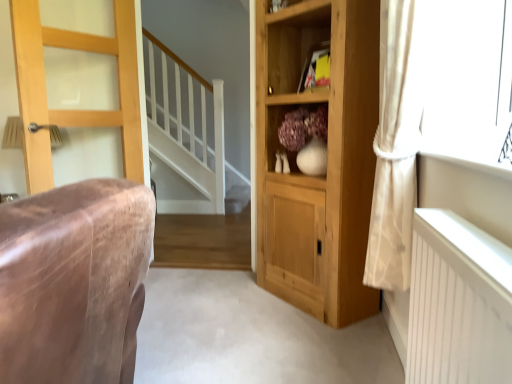
At what (x,y) coordinates should I click in order to perform the action: click on yellow paper at upper center. Please return your answer as a coordinate pair (x, y). The height and width of the screenshot is (384, 512). Looking at the image, I should click on (310, 61).

Image resolution: width=512 pixels, height=384 pixels. What do you see at coordinates (310, 61) in the screenshot?
I see `yellow paper at upper center` at bounding box center [310, 61].

The width and height of the screenshot is (512, 384). Describe the element at coordinates (395, 147) in the screenshot. I see `white sheer curtain at right` at that location.

Where is `natural wood cupboard at center`? The width and height of the screenshot is (512, 384). natural wood cupboard at center is located at coordinates (328, 158).

You are a GUI agent. You are given a task and a screenshot of the screen. Output one action in this format:
    pyautogui.click(x=<x>, y=<y>)
    Task: Click on the light brown wooden door at left
    The height and width of the screenshot is (384, 512).
    Given the screenshot: What is the action you would take?
    pyautogui.click(x=75, y=110)

Identify the location of wooden cabinet at center. The height and width of the screenshot is (384, 512). (295, 129).

Find the location of a particular element. Image resolution: width=512 pixels, height=384 pixels. yellow paper at upper center is located at coordinates (310, 61).

Can you confirm if natural wood cupboard at center is wider than white sheer curtain at right?

Yes, natural wood cupboard at center is wider than white sheer curtain at right.

How different are the orientations of natural wood cupboard at center and white sheer curtain at right in degrees?

natural wood cupboard at center and white sheer curtain at right are facing 41.5 degrees away from each other.

Would you say natural wood cupboard at center is inside or outside white sheer curtain at right?

natural wood cupboard at center lies outside white sheer curtain at right.

Between yellow paper at upper center and wooden cabinet at center, which one has more height?

With more height is wooden cabinet at center.

Who is more distant, yellow paper at upper center or wooden cabinet at center?

yellow paper at upper center.

Based on the photo, in the image, is yellow paper at upper center on the left side or the right side of wooden cabinet at center?

From the image, it's evident that yellow paper at upper center is to the right of wooden cabinet at center.

From the image's perspective, which is below, yellow paper at upper center or wooden cabinet at center?

wooden cabinet at center appears lower in the image.

Considering the relative positions of white sheer curtain at right and yellow paper at upper center in the image provided, is white sheer curtain at right to the left or to the right of yellow paper at upper center?

In the image, white sheer curtain at right appears on the right side of yellow paper at upper center.

Considering the relative positions of white sheer curtain at right and yellow paper at upper center in the image provided, is white sheer curtain at right in front of yellow paper at upper center?

Yes, it is in front of yellow paper at upper center.

From the image's perspective, is white sheer curtain at right beneath yellow paper at upper center?

Indeed, from the image's perspective, white sheer curtain at right is shown beneath yellow paper at upper center.

From a real-world perspective, relative to yellow paper at upper center, is wooden cabinet at center vertically above or below?

In terms of real-world spatial position, wooden cabinet at center is below yellow paper at upper center.

This screenshot has height=384, width=512. In the image, there is a wooden cabinet at center. Find the location of `book above it (from the image's perspective)`. book above it (from the image's perspective) is located at coordinates (310, 61).

Is yellow paper at upper center surrounded by wooden cabinet at center?

That's incorrect, yellow paper at upper center is not inside wooden cabinet at center.

Which object is more forward, wooden cabinet at center or yellow paper at upper center?

wooden cabinet at center is in front.

Is yellow paper at upper center inside or outside of light brown wooden door at left?

yellow paper at upper center lies outside light brown wooden door at left.

Is yellow paper at upper center to the left of light brown wooden door at left from the viewer's perspective?

No.

Does yellow paper at upper center have a lesser height compared to light brown wooden door at left?

Yes.

Considering the positions of points (329, 42) and (35, 160), is point (329, 42) farther from camera compared to point (35, 160)?

Yes, it is behind point (35, 160).

Considering the relative positions of wooden cabinet at center and white sheer curtain at right in the image provided, is wooden cabinet at center to the right of white sheer curtain at right from the viewer's perspective?

Incorrect, wooden cabinet at center is not on the right side of white sheer curtain at right.

From the image's perspective, is wooden cabinet at center over white sheer curtain at right?

Correct, wooden cabinet at center appears higher than white sheer curtain at right in the image.

Are wooden cabinet at center and white sheer curtain at right beside each other?

No.

How different are the orientations of wooden cabinet at center and white sheer curtain at right in degrees?

The angular difference between wooden cabinet at center and white sheer curtain at right is 41.5 degrees.

Is yellow paper at upper center further to the viewer compared to natural wood cupboard at center?

Yes.

Measure the distance between yellow paper at upper center and natural wood cupboard at center.

yellow paper at upper center is 24.06 inches away from natural wood cupboard at center.

Considering the sizes of yellow paper at upper center and natural wood cupboard at center in the image, is yellow paper at upper center wider or thinner than natural wood cupboard at center?

Considering their sizes, yellow paper at upper center looks slimmer than natural wood cupboard at center.

Which object is positioned more to the right, yellow paper at upper center or natural wood cupboard at center?

natural wood cupboard at center is more to the right.

Image resolution: width=512 pixels, height=384 pixels. In order to click on cupboard below the white sheer curtain at right (from a real-world perspective) in this screenshot , I will do `click(328, 158)`.

Image resolution: width=512 pixels, height=384 pixels. I want to click on book above the wooden cabinet at center (from the image's perspective), so click(310, 61).

Estimate the real-world distances between objects in this image. Which object is further from yellow paper at upper center, white sheer curtain at right or light brown wooden door at left?

light brown wooden door at left.

Based on their spatial positions, is white sheer curtain at right or light brown wooden door at left closer to natural wood cupboard at center?

white sheer curtain at right lies closer to natural wood cupboard at center than the other object.

Looking at the image, which one is located closer to natural wood cupboard at center, light brown wooden door at left or yellow paper at upper center?

The object closer to natural wood cupboard at center is yellow paper at upper center.

Based on their spatial positions, is wooden cabinet at center or natural wood cupboard at center further from yellow paper at upper center?

natural wood cupboard at center is further to yellow paper at upper center.

Based on their spatial positions, is natural wood cupboard at center or light brown wooden door at left further from wooden cabinet at center?

The object further to wooden cabinet at center is light brown wooden door at left.

Looking at the image, which one is located further to light brown wooden door at left, natural wood cupboard at center or wooden cabinet at center?

The object further to light brown wooden door at left is natural wood cupboard at center.

Based on their spatial positions, is light brown wooden door at left or white sheer curtain at right closer to wooden cabinet at center?

Based on the image, white sheer curtain at right appears to be nearer to wooden cabinet at center.

When comparing their distances from light brown wooden door at left, does natural wood cupboard at center or white sheer curtain at right seem closer?

natural wood cupboard at center is closer to light brown wooden door at left.

Locate an element on the screen. This screenshot has height=384, width=512. cupboard between white sheer curtain at right and wooden cabinet at center along the z-axis is located at coordinates (328, 158).

You are a GUI agent. You are given a task and a screenshot of the screen. Output one action in this format:
    pyautogui.click(x=<x>, y=<y>)
    Task: Click on the cupboard between light brown wooden door at left and white sheer curtain at right from left to right
    This screenshot has width=512, height=384.
    Given the screenshot: What is the action you would take?
    pyautogui.click(x=328, y=158)

Locate an element on the screen. The width and height of the screenshot is (512, 384). cupboard between white sheer curtain at right and yellow paper at upper center in the front-back direction is located at coordinates (328, 158).

The height and width of the screenshot is (384, 512). Identify the location of cabinet situated between light brown wooden door at left and yellow paper at upper center from left to right. (295, 129).